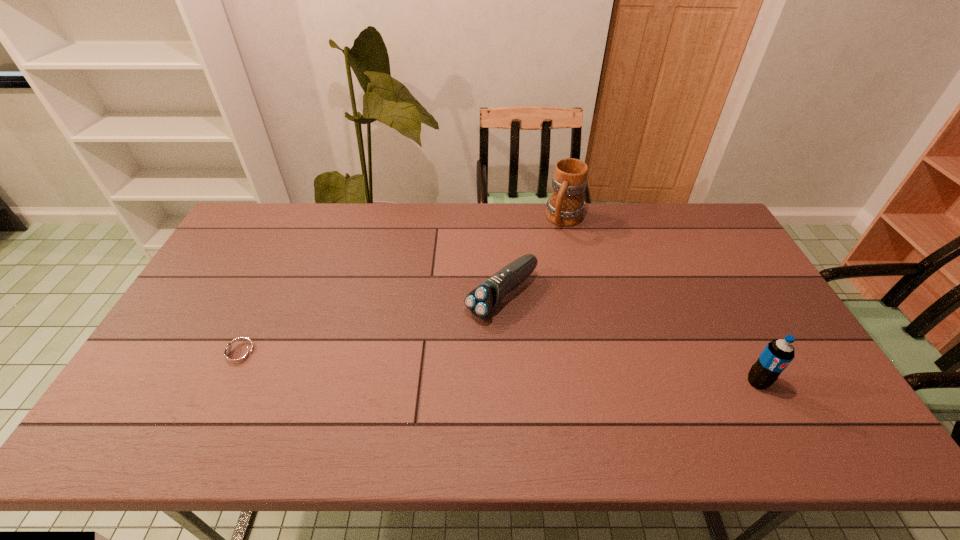
Find the location of a particular element. free spot located 0.320m on the side of the mug with the handle is located at coordinates (529, 294).

Identify the location of blank area located on the side of the mug with the handle. (541, 269).

Find the location of `free space located 0.190m on the side of the mug with the handle`. free space located 0.190m on the side of the mug with the handle is located at coordinates (542, 268).

Locate an element on the screen. This screenshot has width=960, height=540. vacant space located 0.080m on the head of the second object from left to right is located at coordinates (457, 334).

Locate an element on the screen. This screenshot has width=960, height=540. vacant space located 0.300m on the head of the second object from left to right is located at coordinates (396, 384).

Find the location of `vacant space located on the head of the second object from left to right`. vacant space located on the head of the second object from left to right is located at coordinates (386, 393).

Image resolution: width=960 pixels, height=540 pixels. I want to click on object that is at the far edge, so click(565, 207).

Where is `watch located in the near edge section of the desktop`? watch located in the near edge section of the desktop is located at coordinates (239, 354).

At what (x,y) coordinates should I click in order to perform the action: click on soda bottle present at the near edge. Please return your answer as a coordinate pair (x, y). Looking at the image, I should click on (777, 355).

At what (x,y) coordinates should I click in order to perform the action: click on object located at the left edge. Please return your answer as a coordinate pair (x, y). The image size is (960, 540). Looking at the image, I should click on (239, 354).